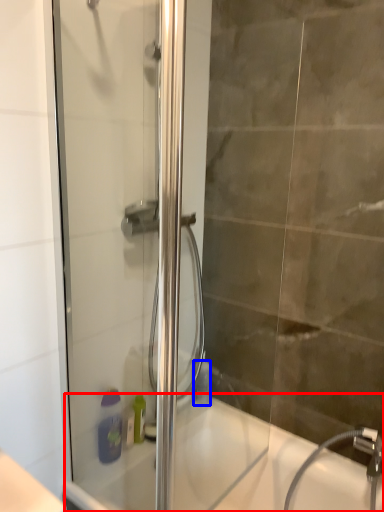
Question: Among these objects, which one is nearest to the camera, bath (highlighted by a red box) or toiletry (highlighted by a blue box)?

Choices:
 (A) bath
 (B) toiletry

Answer: (A)